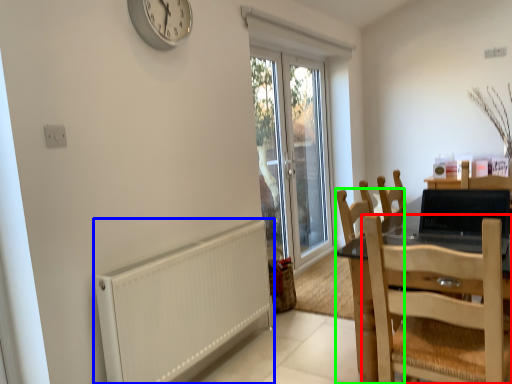
Question: Which object is positioned closest to chair (highlighted by a red box)? Select from radiator (highlighted by a blue box) and chair (highlighted by a green box).

Choices:
 (A) radiator
 (B) chair

Answer: (B)